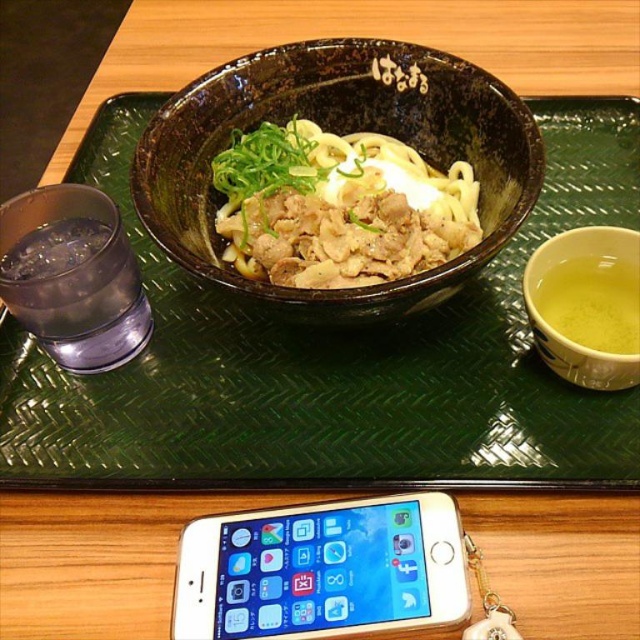
You are a waiter carrying a tray that can hold items up to 5 inches away from its center. You need to place both the green textured tray at center and the black glazed bowl at center on your tray. Can you safely place them without exceeding the tray capacity?

The distance between the green textured tray at center and the black glazed bowl at center is 4.41 inches, which is within the 5 inches limit. Therefore, you can safely place them on the tray without exceeding the capacity.

You are a waiter who needs to place a new dish on the table. The dish is too heavy to lift, so you must slide it across the table from the left side. The dish must be placed between the green textured tray at center and the black glazed bowl at center. Is this possible?

The black glazed bowl at center is behind the green textured tray at center, so there is no space between them for the dish to be placed. Therefore, it is not possible to slide the dish between them.

You are arranging a small tea set on the table and need to ensure that the black glazed bowl at center fits entirely on the green textured tray at center. Based on the scene, will the bowl fit on the tray?

The green textured tray at center is wider than the black glazed bowl at center, so the bowl will fit on the tray.